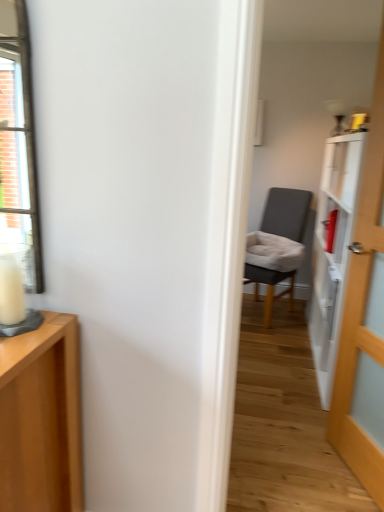
Question: Can you confirm if white wax candle at left is shorter than wooden door at right?

Choices:
 (A) yes
 (B) no

Answer: (A)

Question: Does white wax candle at left lie in front of wooden door at right?

Choices:
 (A) no
 (B) yes

Answer: (B)

Question: Can you confirm if white wax candle at left is wider than wooden door at right?

Choices:
 (A) yes
 (B) no

Answer: (B)

Question: From a real-world perspective, is white wax candle at left beneath wooden door at right?

Choices:
 (A) no
 (B) yes

Answer: (A)

Question: Is white wax candle at left not close to wooden door at right?

Choices:
 (A) no
 (B) yes

Answer: (B)

Question: Is white wax candle at left at the left side of wooden door at right?

Choices:
 (A) yes
 (B) no

Answer: (A)

Question: Does wooden door at right appear on the right side of white wax candle at left?

Choices:
 (A) no
 (B) yes

Answer: (B)

Question: From the image's perspective, is wooden door at right located beneath white wax candle at left?

Choices:
 (A) yes
 (B) no

Answer: (B)

Question: Is wooden door at right thinner than white wax candle at left?

Choices:
 (A) no
 (B) yes

Answer: (A)

Question: From the image's perspective, is wooden door at right over white wax candle at left?

Choices:
 (A) no
 (B) yes

Answer: (B)

Question: Can you confirm if wooden door at right is shorter than white wax candle at left?

Choices:
 (A) yes
 (B) no

Answer: (B)

Question: Is wooden door at right not near white wax candle at left?

Choices:
 (A) no
 (B) yes

Answer: (B)

Question: Does dark gray fabric chair at center have a greater width compared to wooden door at right?

Choices:
 (A) no
 (B) yes

Answer: (B)